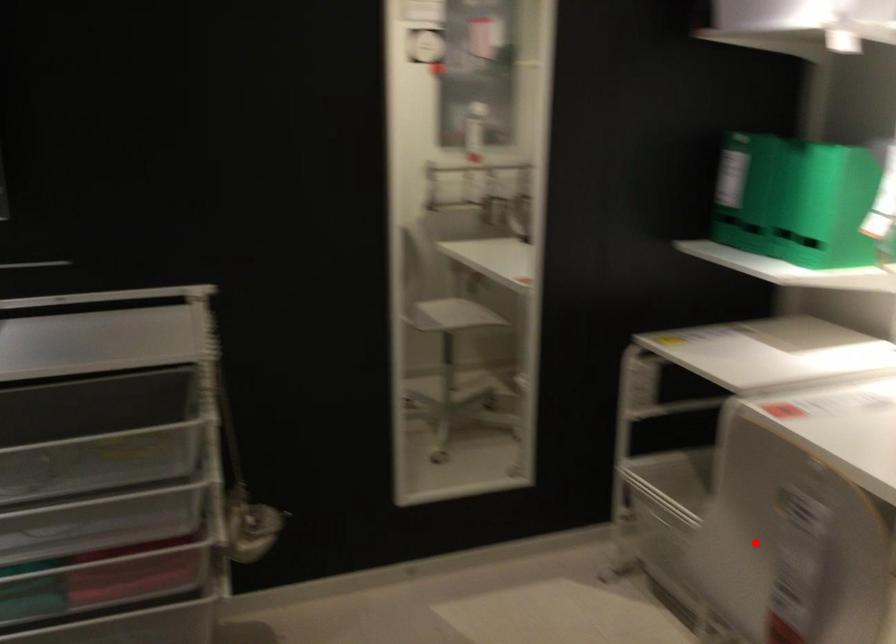
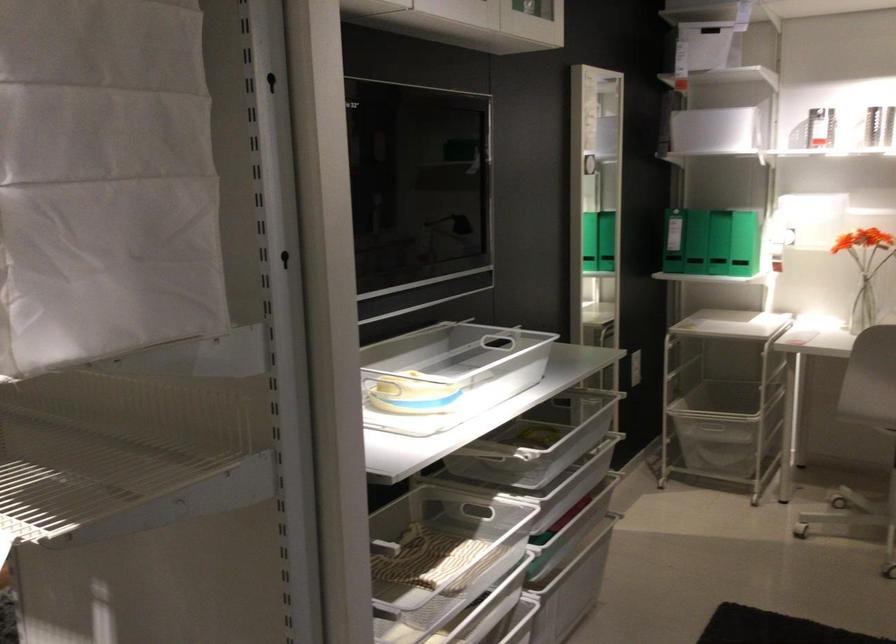
Find the pixel in the second image that matches the highlighted location in the first image.

(869, 379)